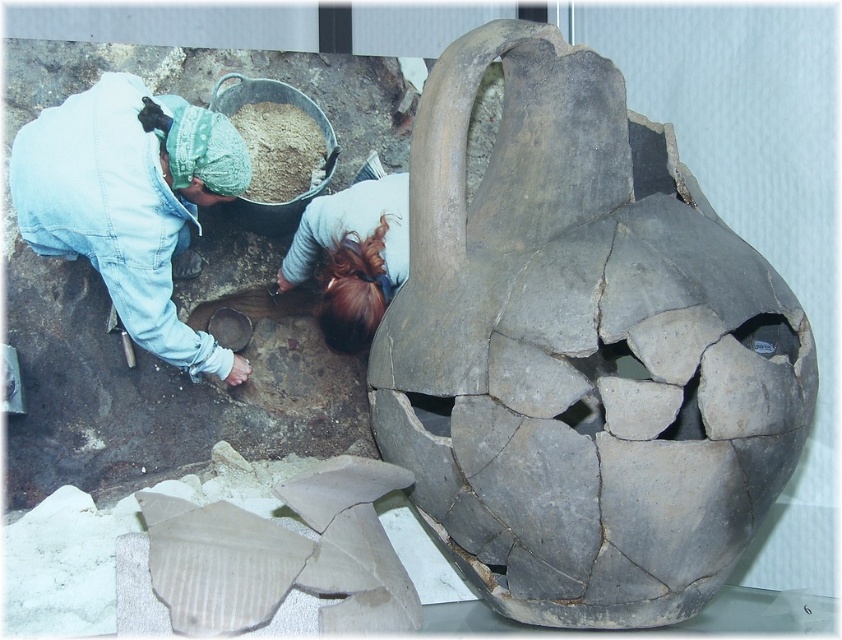
Does denim jacket at lower left appear on the right side of brown powder at center?

Incorrect, denim jacket at lower left is not on the right side of brown powder at center.

Is point (129, 227) positioned in front of point (238, 113)?

Yes, point (129, 227) is closer to viewer.

Where is `denim jacket at lower left`? denim jacket at lower left is located at coordinates [x=131, y=202].

Looking at this image, can you confirm if gray cracked pottery at center is positioned to the right of denim jacket at lower left?

Indeed, gray cracked pottery at center is positioned on the right side of denim jacket at lower left.

How far apart are gray cracked pottery at center and denim jacket at lower left?

They are 18.64 inches apart.

Find the location of a particular element. This screenshot has height=640, width=842. gray cracked pottery at center is located at coordinates (581, 349).

The height and width of the screenshot is (640, 842). In order to click on gray cracked pottery at center in this screenshot , I will do `click(581, 349)`.

Who is higher up, brown hair at lower center or brown powder at center?

brown powder at center

Between brown hair at lower center and brown powder at center, which one has less height?

brown powder at center

The height and width of the screenshot is (640, 842). I want to click on brown hair at lower center, so click(x=352, y=257).

Image resolution: width=842 pixels, height=640 pixels. What are the coordinates of `brown hair at lower center` in the screenshot? It's located at (352, 257).